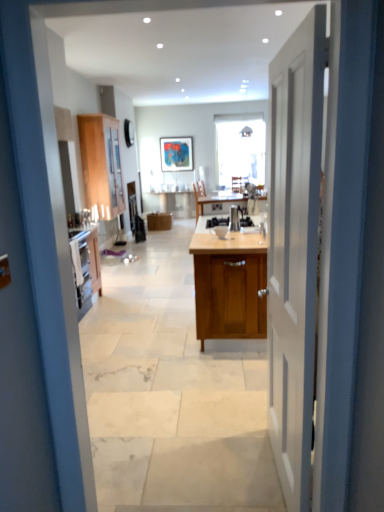
Question: From the image's perspective, is wooden cabinet at center, which is the 3th cabinetry from left to right, beneath wooden chair at center?

Choices:
 (A) no
 (B) yes

Answer: (B)

Question: Does wooden cabinet at center, the 3th cabinetry viewed from the back, appear on the left side of wooden chair at center?

Choices:
 (A) yes
 (B) no

Answer: (A)

Question: Can we say wooden cabinet at center, the 1th cabinetry in the right-to-left sequence, lies outside wooden chair at center?

Choices:
 (A) no
 (B) yes

Answer: (B)

Question: Is the depth of wooden cabinet at center, the 3th cabinetry viewed from the back, greater than that of wooden chair at center?

Choices:
 (A) no
 (B) yes

Answer: (A)

Question: Do you think white wooden door at center is within wooden cabinet at center, which is the first cabinetry in front-to-back order, or outside of it?

Choices:
 (A) outside
 (B) inside

Answer: (A)

Question: Would you say white wooden door at center is to the left or to the right of wooden cabinet at center, which is the 3th cabinetry from left to right, in the picture?

Choices:
 (A) left
 (B) right

Answer: (A)

Question: Looking at the image, does white wooden door at center seem bigger or smaller compared to wooden cabinet at center, which is the 3th cabinetry from left to right?

Choices:
 (A) small
 (B) big

Answer: (A)

Question: From the image's perspective, relative to wooden cabinet at center, which is the first cabinetry in front-to-back order, is white wooden door at center above or below?

Choices:
 (A) below
 (B) above

Answer: (A)

Question: Considering the positions of point (114, 148) and point (291, 368), is point (114, 148) closer or farther from the camera than point (291, 368)?

Choices:
 (A) closer
 (B) farther

Answer: (B)

Question: From a real-world perspective, is wooden cabinet at left, which is the second cabinetry from back to front, positioned above or below white wooden door at center?

Choices:
 (A) below
 (B) above

Answer: (B)

Question: Considering the positions of wooden cabinet at left, which appears as the second cabinetry when viewed from the front, and white wooden door at center in the image, is wooden cabinet at left, which appears as the second cabinetry when viewed from the front, wider or thinner than white wooden door at center?

Choices:
 (A) thin
 (B) wide

Answer: (B)

Question: From their relative heights in the image, would you say wooden cabinet at left, the first cabinetry from the left, is taller or shorter than white wooden door at center?

Choices:
 (A) tall
 (B) short

Answer: (B)

Question: Looking at their shapes, would you say wooden cabinet at left, the first cabinetry from the left, is wider or thinner than wooden cabinet at center, the 1th cabinetry viewed from the back?

Choices:
 (A) thin
 (B) wide

Answer: (A)

Question: From a real-world perspective, is wooden cabinet at left, the first cabinetry from the left, physically located above or below wooden cabinet at center, which is the 3th cabinetry from front to back?

Choices:
 (A) above
 (B) below

Answer: (A)